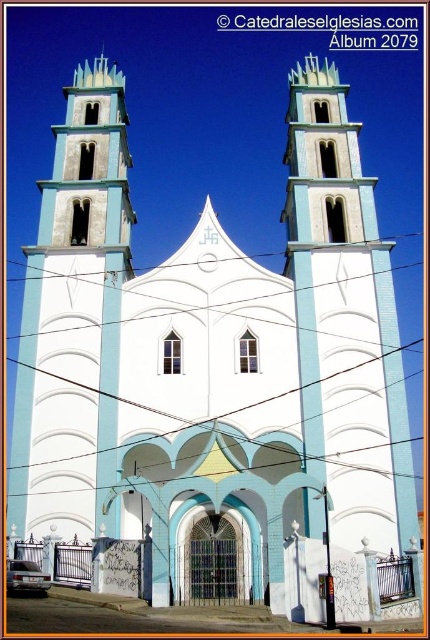
Question: Where is light blue stone tower at center located in relation to white smooth tower at center in the image?

Choices:
 (A) right
 (B) left

Answer: (A)

Question: Does light blue stone tower at center have a smaller size compared to white smooth tower at center?

Choices:
 (A) yes
 (B) no

Answer: (A)

Question: Which point appears farthest from the camera in this image?

Choices:
 (A) (116, 308)
 (B) (321, 77)

Answer: (B)

Question: Which point is farther from the camera taking this photo?

Choices:
 (A) (340, 236)
 (B) (95, 499)

Answer: (A)

Question: Considering the relative positions of light blue stone tower at center and white smooth tower at center in the image provided, where is light blue stone tower at center located with respect to white smooth tower at center?

Choices:
 (A) left
 (B) right

Answer: (B)

Question: Which point is farther from the camera taking this photo?

Choices:
 (A) (347, 497)
 (B) (101, 420)

Answer: (B)